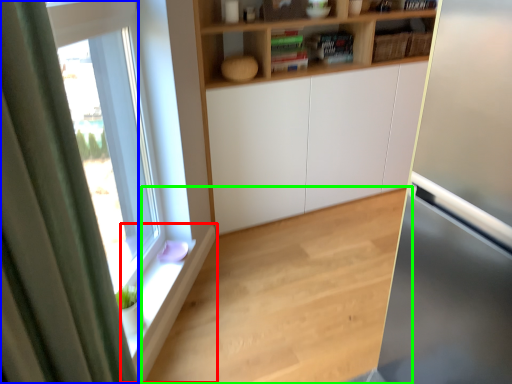
Question: Considering the real-world distances, which object is closest to window sill (highlighted by a red box)? curtain (highlighted by a blue box) or hardwood (highlighted by a green box).

Choices:
 (A) curtain
 (B) hardwood

Answer: (B)